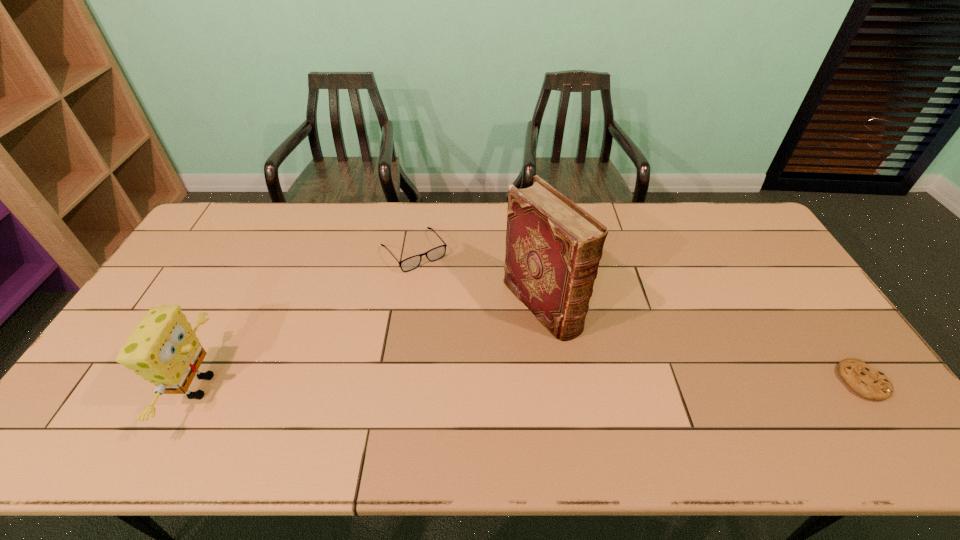
Where is `free spot located 0.150m on the front-facing side of the spectacles`? Image resolution: width=960 pixels, height=540 pixels. free spot located 0.150m on the front-facing side of the spectacles is located at coordinates (x=452, y=301).

The image size is (960, 540). I want to click on free region located on the front-facing side of the spectacles, so click(479, 335).

The image size is (960, 540). I want to click on free location located on the front-facing side of the spectacles, so click(469, 323).

Where is `vacant space located on the spine side of the hardback book`? This screenshot has height=540, width=960. vacant space located on the spine side of the hardback book is located at coordinates (640, 410).

At what (x,y) coordinates should I click in order to perform the action: click on free space located 0.130m on the spine side of the hardback book. Please return your answer as a coordinate pair (x, y). This screenshot has height=540, width=960. Looking at the image, I should click on (600, 369).

You are a GUI agent. You are given a task and a screenshot of the screen. Output one action in this format:
    pyautogui.click(x=<x>, y=<y>)
    Task: Click on the vacant space located on the spine side of the hardback book
    This screenshot has height=540, width=960.
    Given the screenshot: What is the action you would take?
    pyautogui.click(x=611, y=380)

You are a GUI agent. You are given a task and a screenshot of the screen. Output one action in this format:
    pyautogui.click(x=<x>, y=<y>)
    Task: Click on the object that is positioned at the far edge
    This screenshot has width=960, height=540.
    Given the screenshot: What is the action you would take?
    (x=411, y=263)

Identify the location of sponge that is positioned at the near edge. tap(163, 349).

Locate an element on the screen. This screenshot has width=960, height=540. cookie positioned at the near edge is located at coordinates (869, 383).

Find the location of a particular element. Image resolution: width=960 pixels, height=540 pixels. object located at the right edge is located at coordinates (869, 383).